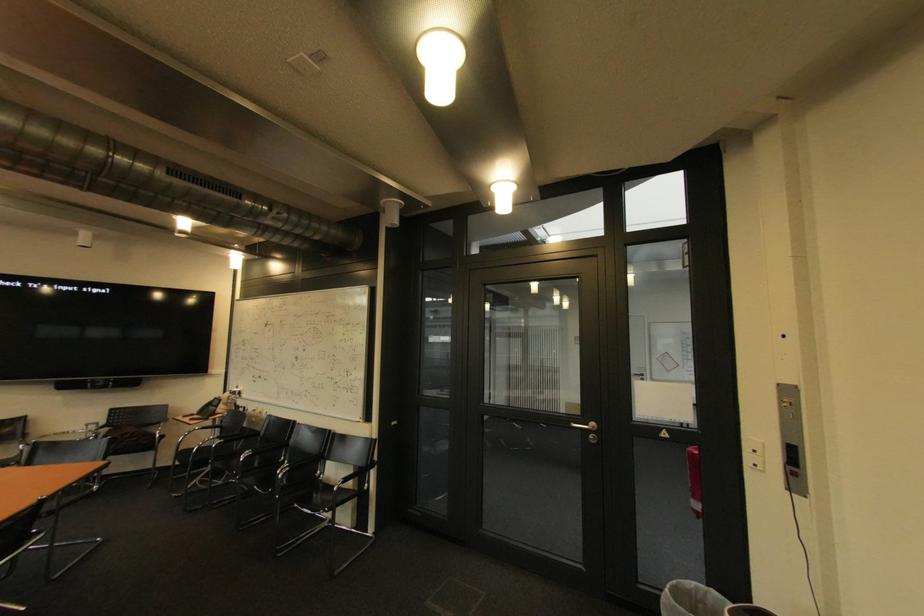
Where would you pull the metal door handle? Please return your answer as a coordinate pair (x, y).

(588, 430)